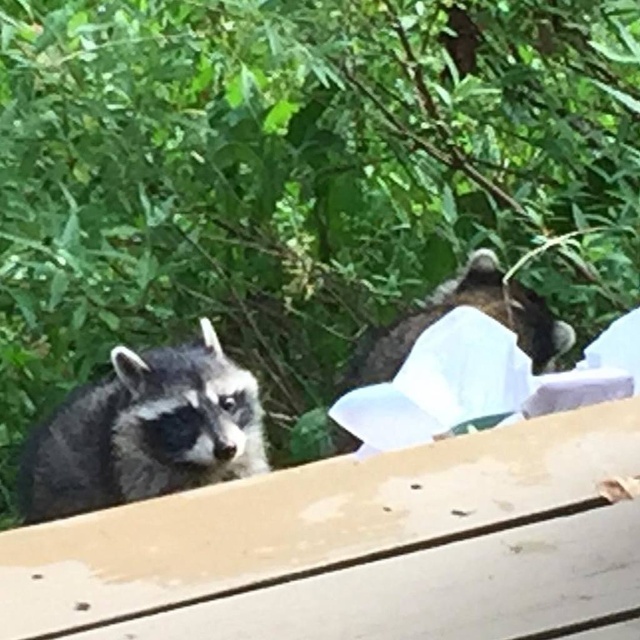
You are a wildlife photographer trying to capture both the gray fur raccoon at left and the dark gray fur raccoon at center in a single shot. Based on their positions, which raccoon would appear lower in the photo?

The gray fur raccoon at left appears lower in the photo because it is positioned below the dark gray fur raccoon at center.

You are a wildlife photographer trying to capture both raccoons in a single shot. The gray fur raccoon at left is blocking the view of the dark gray fur raccoon at center. Can you adjust your position to see both raccoons clearly without moving them?

The gray fur raccoon at left is larger in size than the dark gray fur raccoon at center, so moving to the side might allow you to see around the larger raccoon to view both.